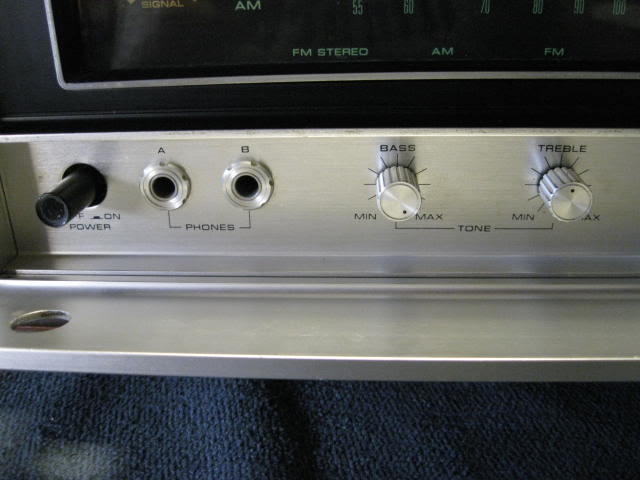
Locate an element on the screen. The width and height of the screenshot is (640, 480). clock is located at coordinates (255, 12).